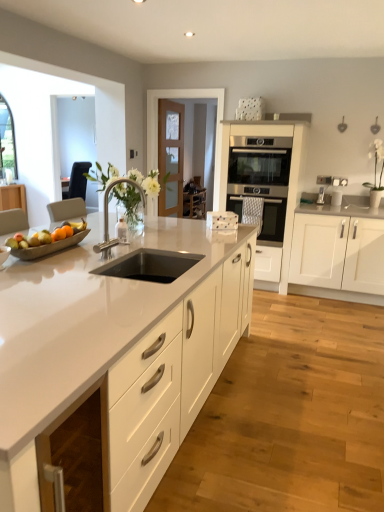
I want to click on unoccupied area in front of matte gray tray at left, so click(x=50, y=270).